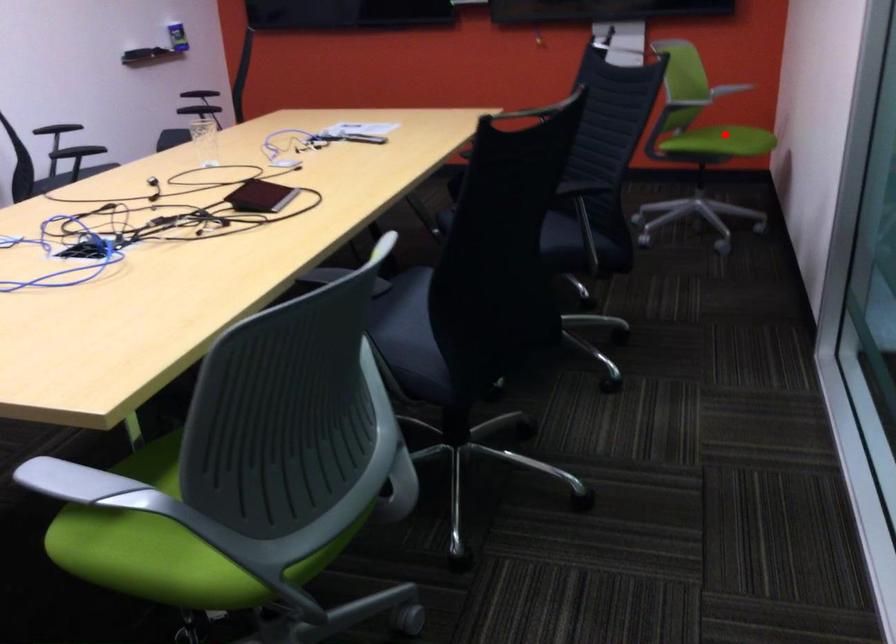
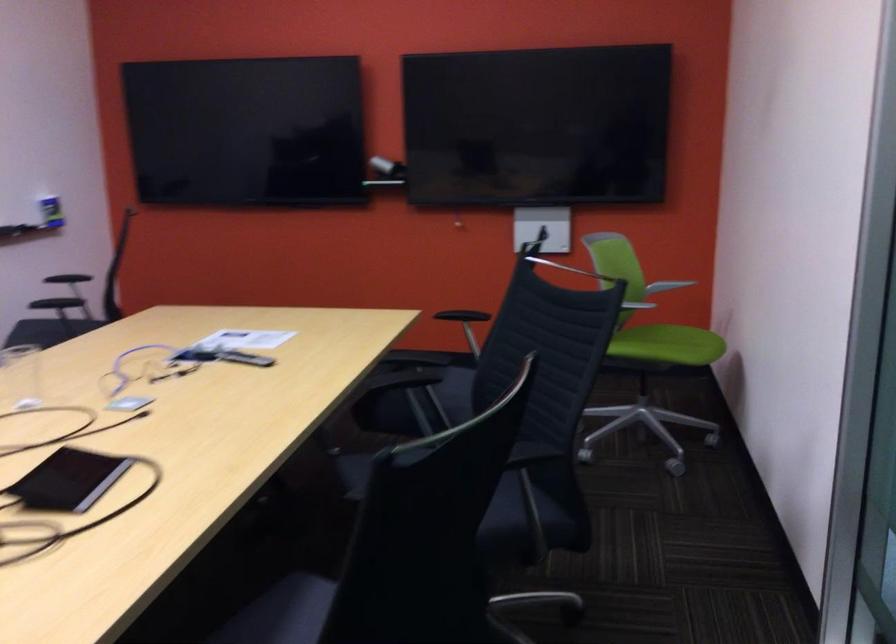
Question: I am providing you with two images of the same scene from different viewpoints. A red point is shown in image1. For the corresponding object point in image2, is it positioned nearer or farther from the camera?

Choices:
 (A) Nearer
 (B) Farther

Answer: (A)